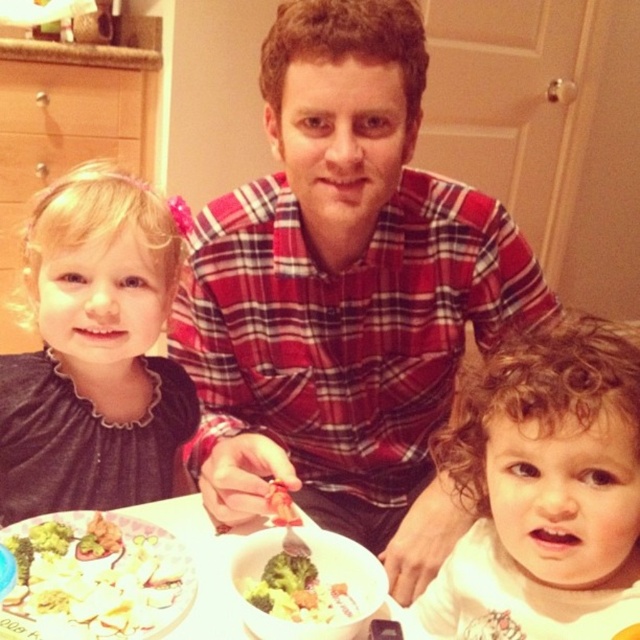
In the scene shown: Is dark gray fabric dress at left positioned before green broccoli at lower center?

No, dark gray fabric dress at left is behind green broccoli at lower center.

Can you confirm if dark gray fabric dress at left is positioned above green broccoli at lower center?

Correct, dark gray fabric dress at left is located above green broccoli at lower center.

Measure the distance between point (150, 406) and camera.

Point (150, 406) and camera are 37.76 inches apart.

At what (x,y) coordinates should I click in order to perform the action: click on dark gray fabric dress at left. Please return your answer as a coordinate pair (x, y). The height and width of the screenshot is (640, 640). Looking at the image, I should click on (96, 352).

In the scene shown: Who is lower down, green broccoli florets at lower left or white glossy bowl at center?

white glossy bowl at center is lower down.

Measure the distance between point [154,548] and camera.

The distance of point [154,548] from camera is 28.78 inches.

Find the location of `green broccoli florets at lower left`. green broccoli florets at lower left is located at coordinates (93, 579).

Where is `green broccoli florets at lower left`? green broccoli florets at lower left is located at coordinates (93, 579).

Which is more to the right, curly brown hair at center or green broccoli at lower center?

From the viewer's perspective, curly brown hair at center appears more on the right side.

Where is `curly brown hair at center`? The height and width of the screenshot is (640, 640). curly brown hair at center is located at coordinates (545, 492).